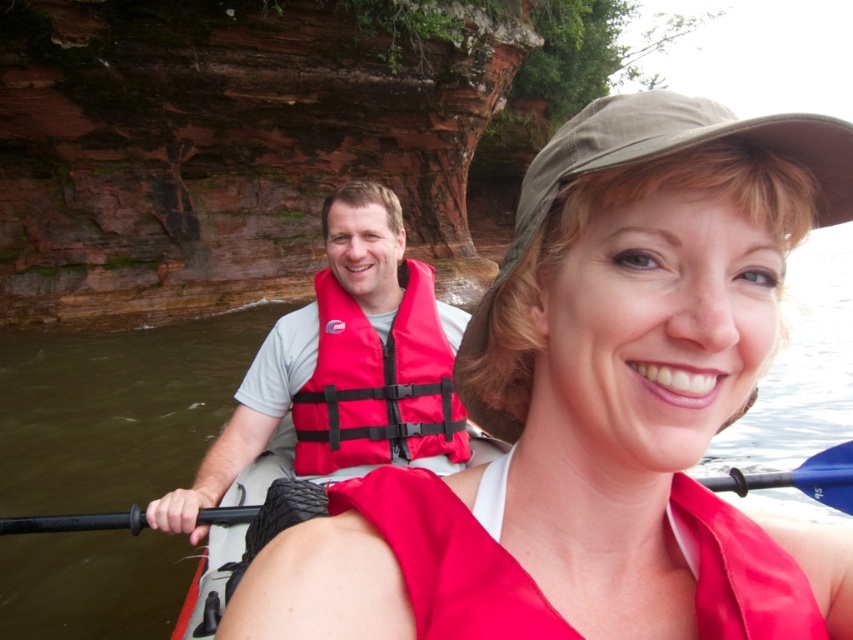
Consider the image. Can you confirm if red matte life jacket at center is shorter than black rubber paddle at center?

Yes.

Which is below, red matte life jacket at center or black rubber paddle at center?

black rubber paddle at center

Find the location of a particular element. The width and height of the screenshot is (853, 640). red matte life jacket at center is located at coordinates (450, 557).

This screenshot has height=640, width=853. Find the location of `red matte life jacket at center`. red matte life jacket at center is located at coordinates (450, 557).

Who is higher up, red matte life jacket at center or red life vest at center?

Positioned higher is red life vest at center.

What do you see at coordinates (450, 557) in the screenshot? I see `red matte life jacket at center` at bounding box center [450, 557].

What are the coordinates of `red matte life jacket at center` in the screenshot? It's located at (450, 557).

Does point (682, 138) come farther from viewer compared to point (804, 486)?

No, it is in front of (804, 486).

Between matte red life vest at center and black rubber paddle at center, which one is positioned lower?

Positioned lower is black rubber paddle at center.

At what (x,y) coordinates should I click in order to perform the action: click on matte red life vest at center. Please return your answer as a coordinate pair (x, y). Image resolution: width=853 pixels, height=640 pixels. Looking at the image, I should click on (633, 339).